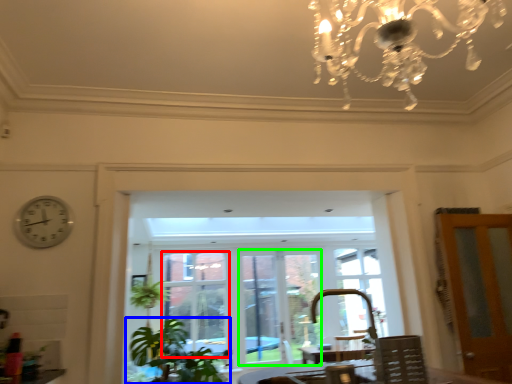
Question: Which is farther away from window (highlighted by a red box)? houseplant (highlighted by a blue box) or window frame (highlighted by a green box)?

Choices:
 (A) houseplant
 (B) window frame

Answer: (A)